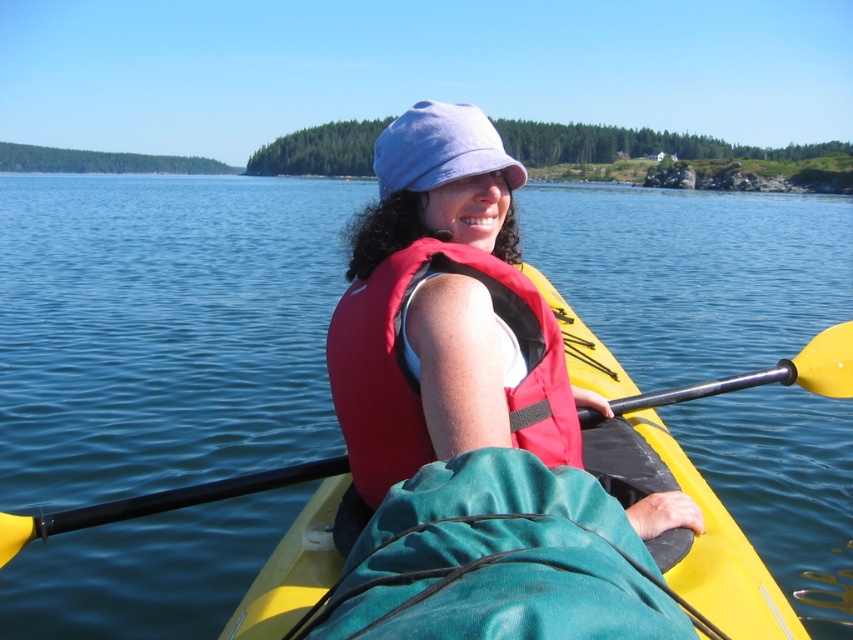
Does matte red life vest at center have a greater width compared to yellow plastic canoe at center?

Indeed, matte red life vest at center has a greater width compared to yellow plastic canoe at center.

What do you see at coordinates (444, 316) in the screenshot? This screenshot has height=640, width=853. I see `matte red life vest at center` at bounding box center [444, 316].

The width and height of the screenshot is (853, 640). I want to click on matte red life vest at center, so click(444, 316).

Is point (514, 344) positioned in front of point (384, 337)?

No, it is behind (384, 337).

Which is more to the left, matte red life vest at center or red matte life jacket at center?

red matte life jacket at center is more to the left.

Between point (421, 160) and point (454, 259), which one is positioned behind?

Positioned behind is point (421, 160).

Locate an element on the screen. The width and height of the screenshot is (853, 640). matte red life vest at center is located at coordinates (444, 316).

Does point (140, 282) come in front of point (527, 380)?

No.

Who is shorter, blue water at center or matte red life vest at center?

matte red life vest at center

Who is more distant from viewer, (689, 369) or (386, 144)?

The point (689, 369) is more distant.

Where is `blue water at center`? This screenshot has height=640, width=853. blue water at center is located at coordinates (161, 328).